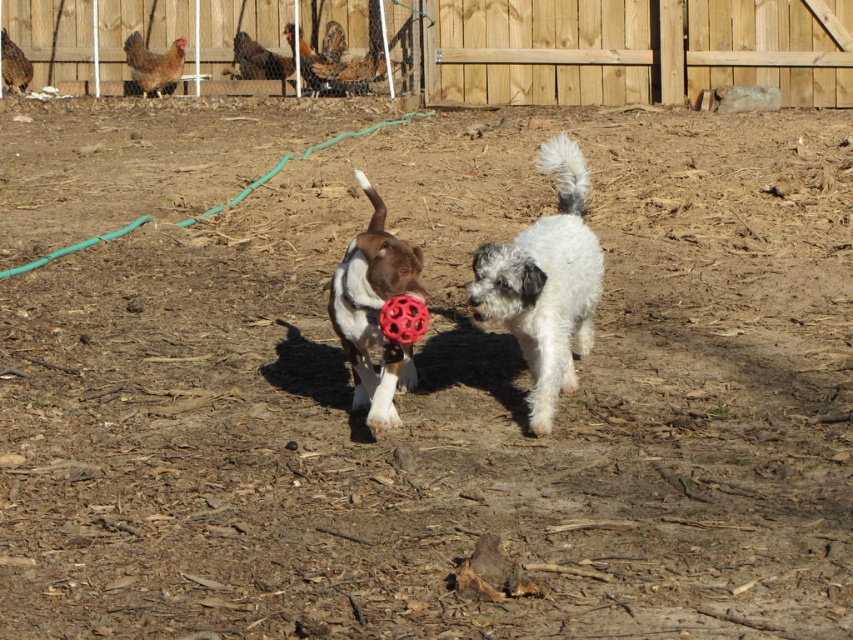
Question: Which object appears closest to the camera in this image?

Choices:
 (A) wooden fence at upper center
 (B) brown and white fur at center

Answer: (B)

Question: Does wooden fence at upper center lie behind white fluffy dog at center?

Choices:
 (A) no
 (B) yes

Answer: (B)

Question: Is the position of white fluffy dog at center less distant than that of brown and white fur at center?

Choices:
 (A) yes
 (B) no

Answer: (B)

Question: Is white fluffy dog at center behind red rubber ball at center?

Choices:
 (A) no
 (B) yes

Answer: (B)

Question: Based on their relative distances, which object is farther from the red rubber ball at center?

Choices:
 (A) white fluffy dog at center
 (B) wooden fence at upper center
 (C) brown and white fur at center

Answer: (B)

Question: Which of the following is the farthest from the observer?

Choices:
 (A) white fluffy dog at center
 (B) wooden fence at upper center
 (C) brown and white fur at center
 (D) red rubber ball at center

Answer: (B)